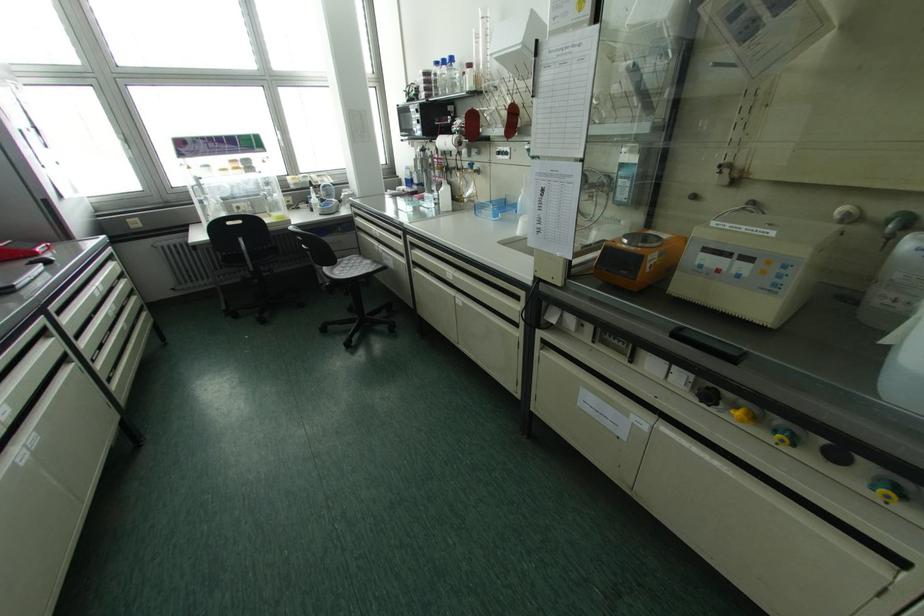
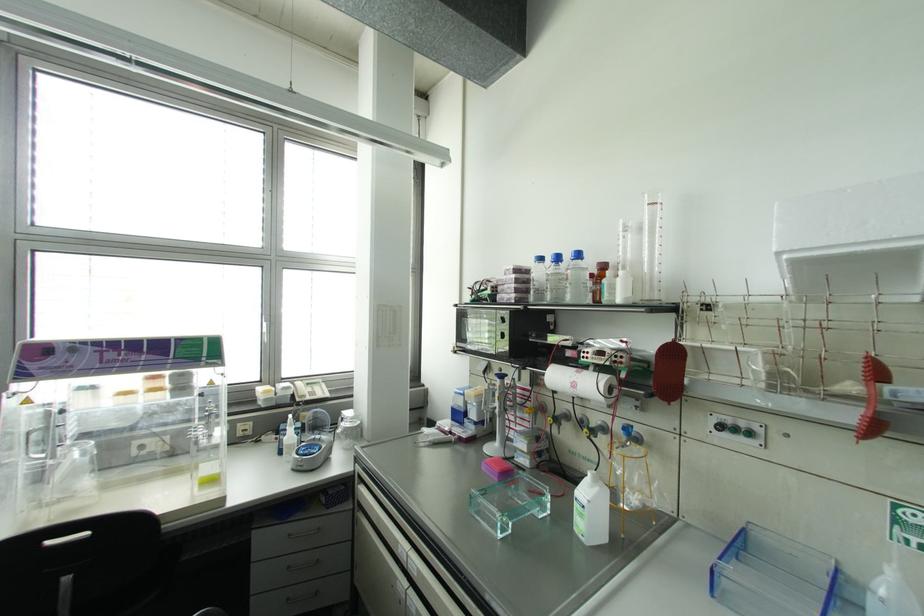
Which direction would the cameraman need to move to produce the second image?

The cameraman moved toward left, forward.